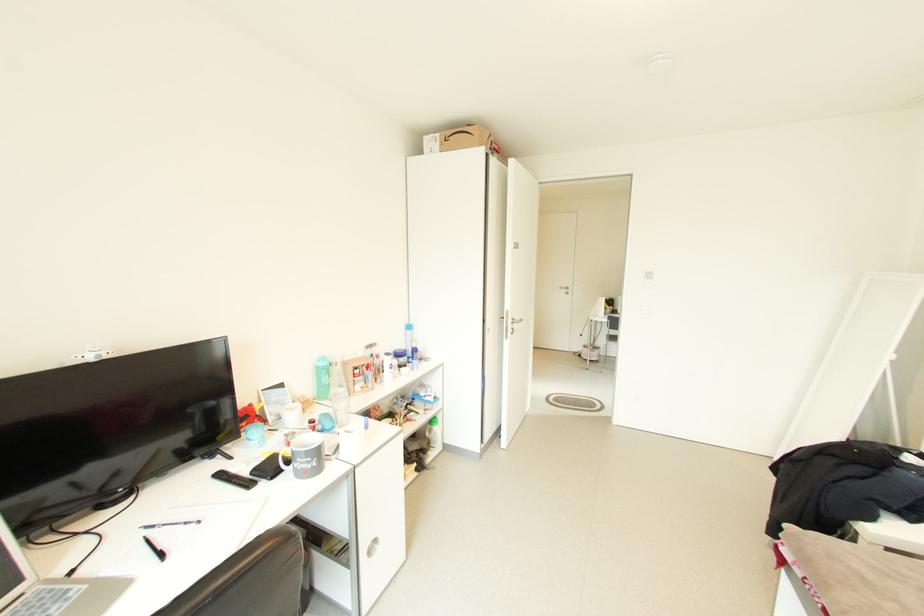
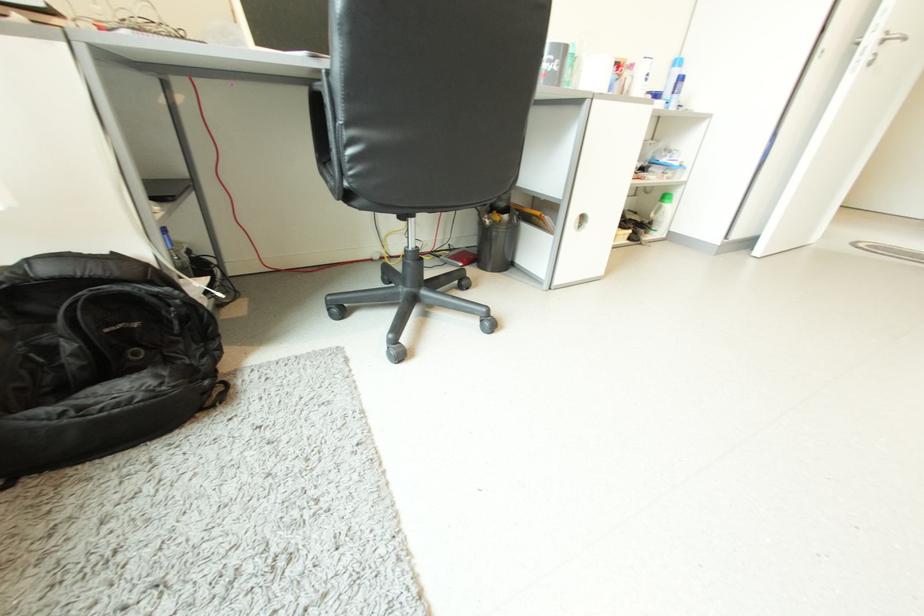
The first image is from the beginning of the video and the second image is from the end. How did the camera likely rotate when shooting the video?

The rotation direction of the camera is left-down.